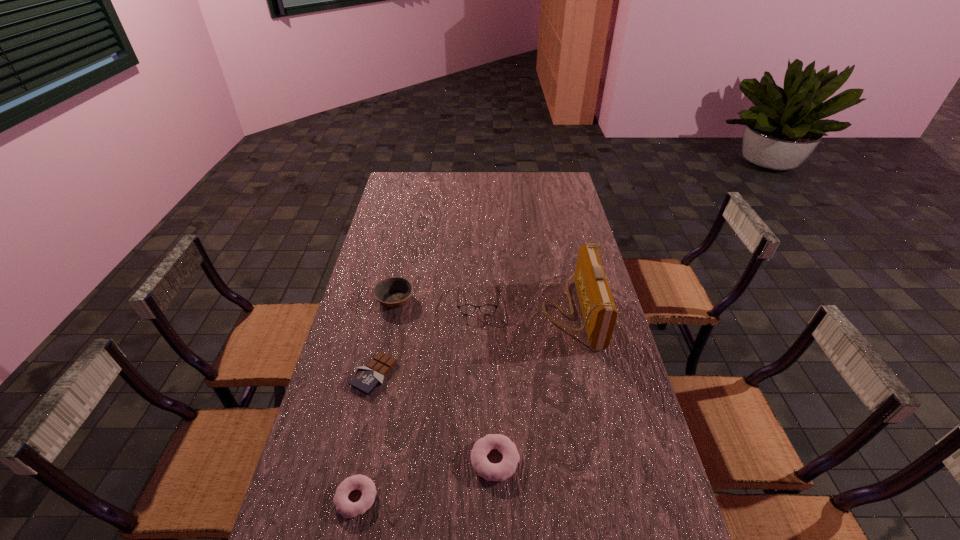
This screenshot has width=960, height=540. Find the location of `vacant space that's between the bowl and the third shortest object`. vacant space that's between the bowl and the third shortest object is located at coordinates (445, 380).

Find the location of a particular element. empty location between the taller doughnut and the fourth farthest object is located at coordinates (435, 417).

The height and width of the screenshot is (540, 960). What are the coordinates of `free spot between the handbag and the chocolate bar` in the screenshot? It's located at (474, 342).

Find the location of a particular element. free space between the fourth tallest object and the third nearest object is located at coordinates (435, 417).

Where is `blank region between the taller doughnut and the left doughnut`? blank region between the taller doughnut and the left doughnut is located at coordinates (x=425, y=479).

What are the coordinates of `free area in between the right doughnut and the third nearest object` in the screenshot? It's located at (435, 417).

Locate an element on the screen. The image size is (960, 540). free space that is in between the bowl and the tallest object is located at coordinates (485, 305).

Find the location of a particular element. object that can be found as the second closest to the right doughnut is located at coordinates (367, 378).

Select which object appears as the second closest to the spectacles. Please provide its 2D coordinates. Your answer should be formatted as a tuple, i.e. [(x, y)], where the tuple contains the x and y coordinates of a point satisfying the conditions above.

[(599, 312)]

Identify the location of vacant space that satisfies the following two spatial constraints: 1. on the front side of the right doughnut; 2. on the right side of the chocolate bar. (355, 460).